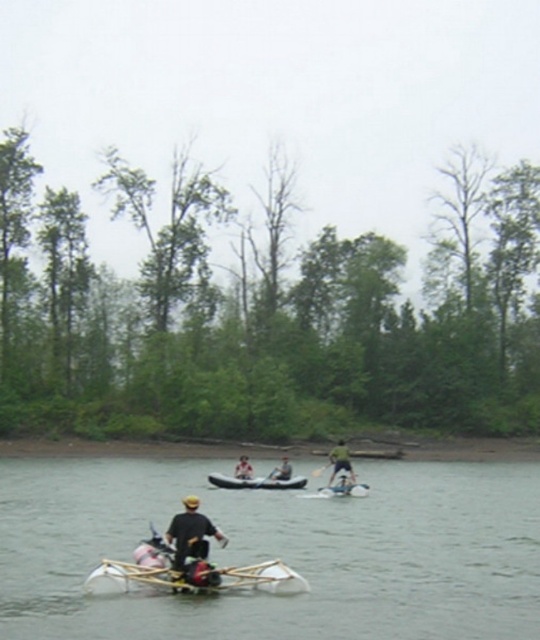
You are on the matte black canoe at center and want to reach the light brown wooden paddle at center. Which direction should you move to get closer to it?

The matte black canoe at center is in front of the light brown wooden paddle at center, so you should move backward to get closer to the light brown wooden paddle at center.

You are standing on the shore and see the matte black canoe at center and the white fabric kayak at center. Which one is positioned to the right?

The matte black canoe at center is positioned to the right of the white fabric kayak at center.

You are planning to take a ride on one of the two rafts available in the scene. The white plastic raft at lower center and the white rubber canoe at center. You have a height restriction of 1.5 meters. Which raft can you safely board without hitting your head?

The white rubber canoe at center is shorter in height compared to the white plastic raft at lower center. Since the plastic raft is much taller, it may exceed your 1.5 meters height restriction. Therefore, the white rubber canoe at center would be the safer option to board without hitting your head.